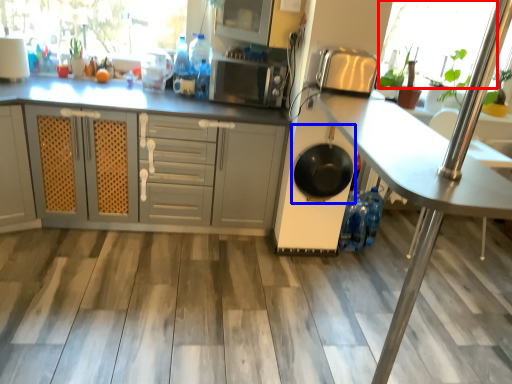
Question: Which point is further to the camera, window screen (highlighted by a red box) or frying pan (highlighted by a blue box)?

Choices:
 (A) window screen
 (B) frying pan

Answer: (A)